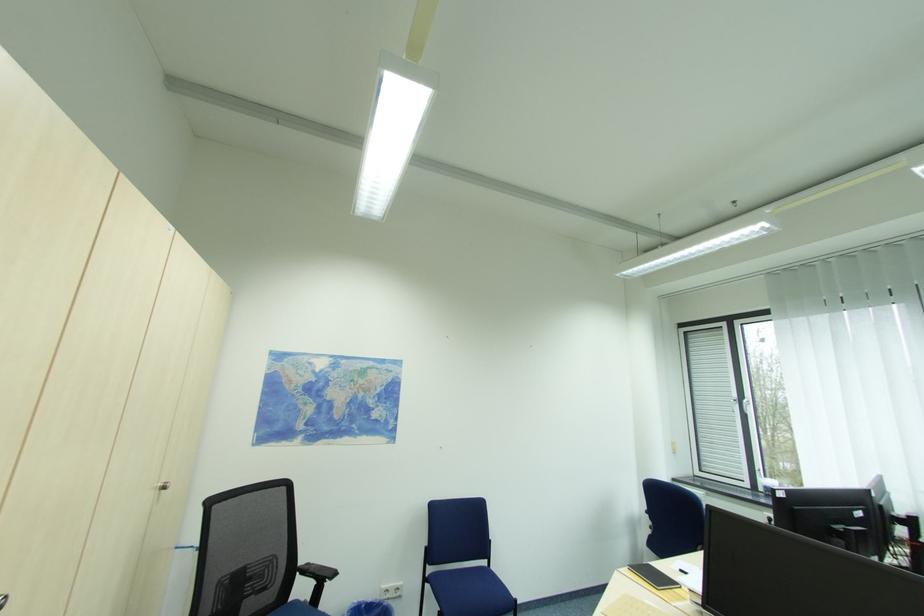
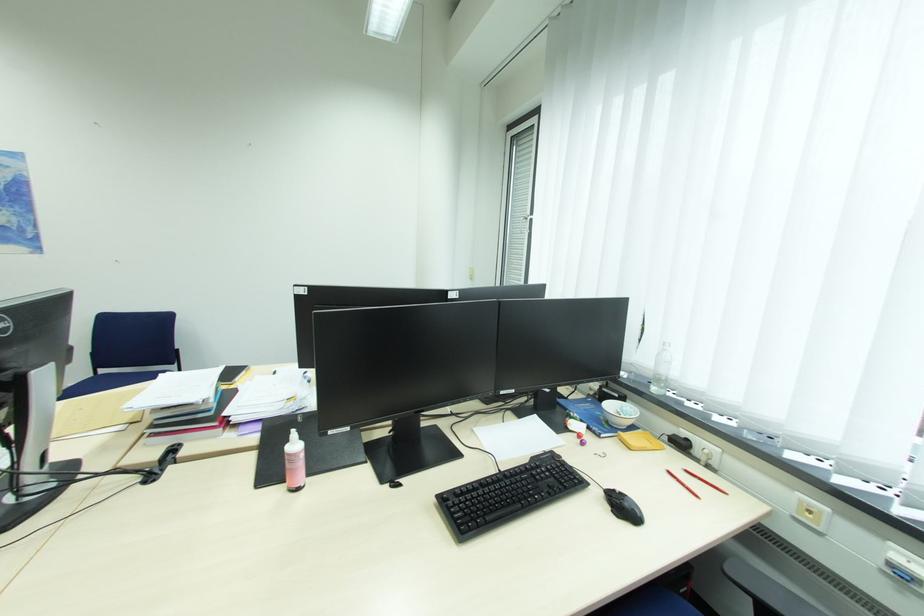
Question: Which direction would the cameraman need to move to produce the second image? Reply with the corresponding letter.

Choices:
 (A) Left
 (B) Right
 (C) Forward
 (D) Backward

Answer: (B)